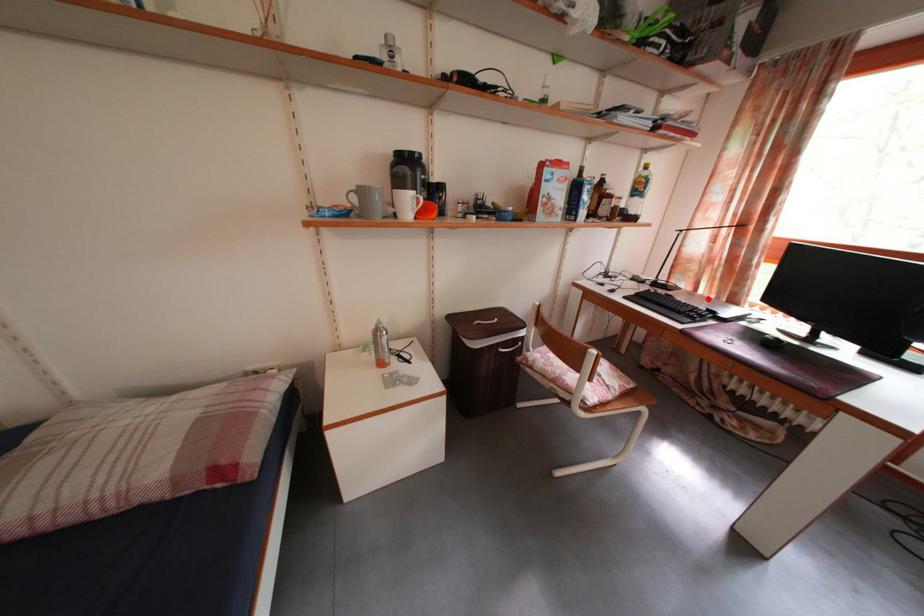
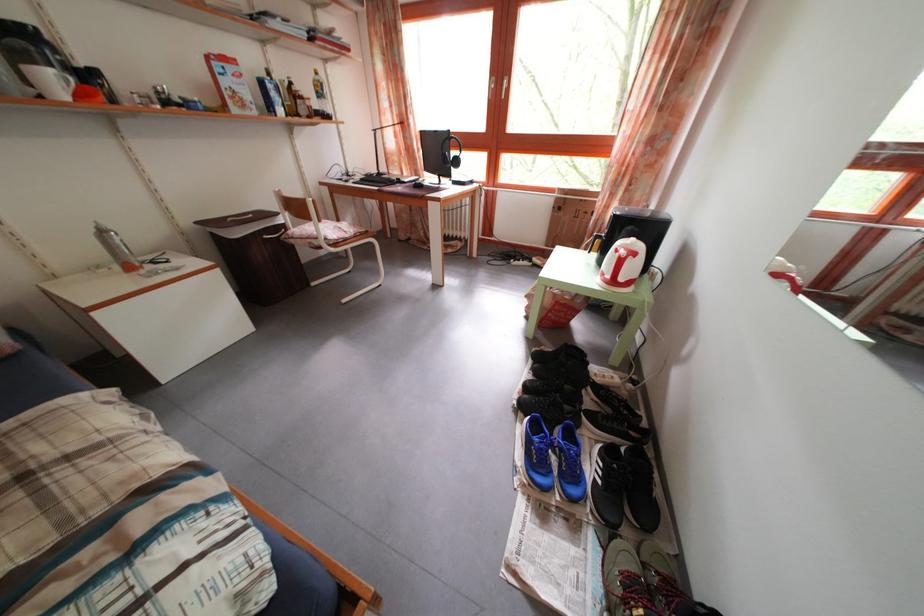
In the second image, find the point that corresponds to the highlighted location in the first image.

(412, 182)